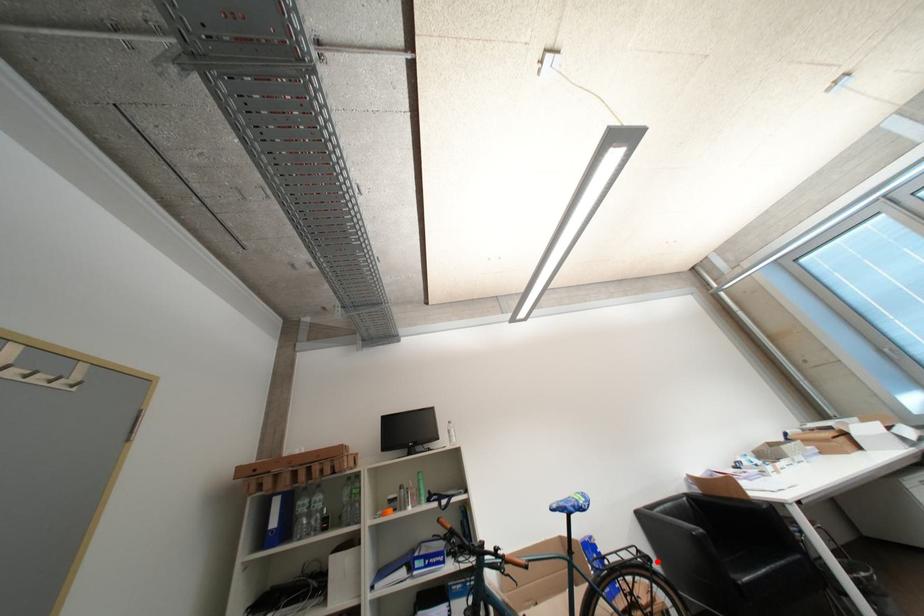
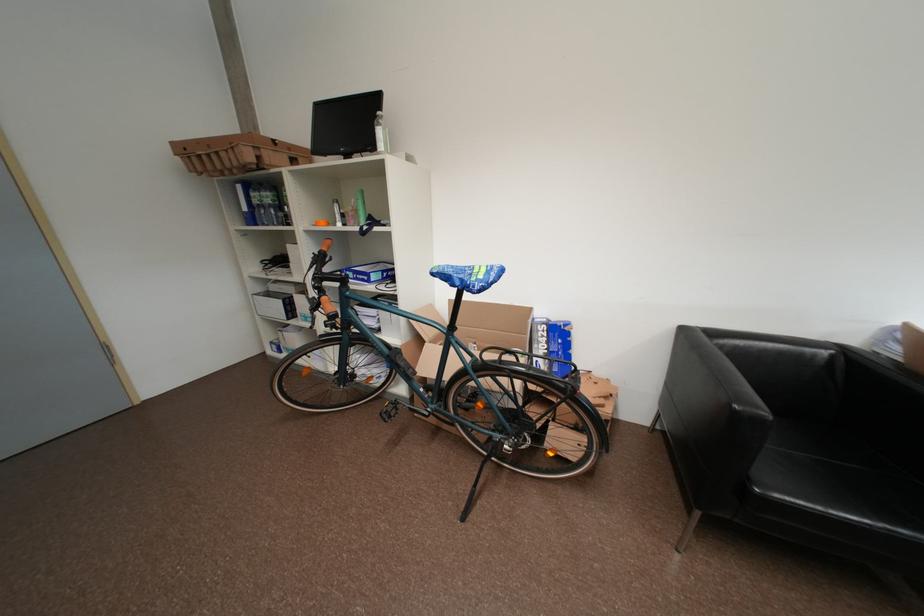
Question: I am providing you with two images of the same scene from different viewpoints. Image1 has a red point marked. In image2, the corresponding 3D location appears at what relative position? Reply with the corresponding letter.

Choices:
 (A) Closer
 (B) Farther

Answer: (B)